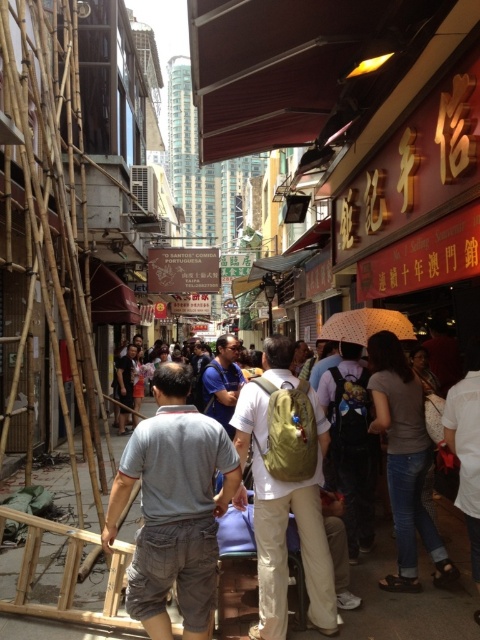
You are a photographer trying to capture a clear shot of both the blue fabric shirt at center and the white matte umbrella at center in the bustling street scene. Given their sizes, which object will require you to zoom in more to include its full detail in the photo?

The blue fabric shirt at center has a larger size compared to the white matte umbrella at center, so you will need to zoom in more to capture the entire blue fabric shirt at center in the photo.